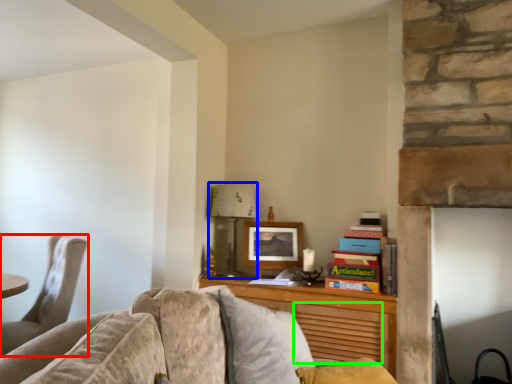
Question: Estimate the real-world distances between objects in this image. Which object is farther from chair (highlighted by a red box), lamp (highlighted by a blue box) or drawer (highlighted by a green box)?

Choices:
 (A) lamp
 (B) drawer

Answer: (B)